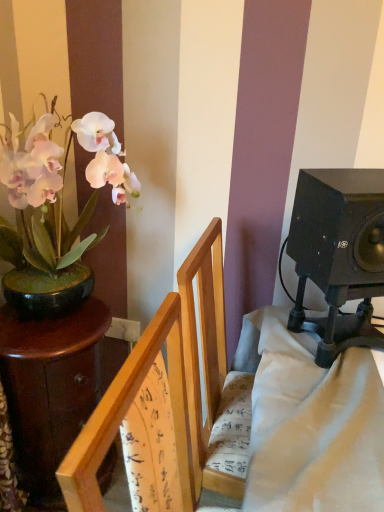
Question: Is black matte speaker at right not near dark brown wooden table at left?

Choices:
 (A) yes
 (B) no

Answer: (B)

Question: Would you say black matte speaker at right contains dark brown wooden table at left?

Choices:
 (A) no
 (B) yes

Answer: (A)

Question: Is black matte speaker at right to the left of dark brown wooden table at left from the viewer's perspective?

Choices:
 (A) yes
 (B) no

Answer: (B)

Question: Does black matte speaker at right have a lesser width compared to dark brown wooden table at left?

Choices:
 (A) no
 (B) yes

Answer: (B)

Question: Is black matte speaker at right further to camera compared to dark brown wooden table at left?

Choices:
 (A) no
 (B) yes

Answer: (A)

Question: Based on their sizes in the image, would you say white matte orchid at left is bigger or smaller than wooden chair at center?

Choices:
 (A) big
 (B) small

Answer: (B)

Question: Based on their positions, is white matte orchid at left located to the left or right of wooden chair at center?

Choices:
 (A) left
 (B) right

Answer: (A)

Question: Is point (21, 162) positioned closer to the camera than point (94, 418)?

Choices:
 (A) closer
 (B) farther

Answer: (B)

Question: From their relative heights in the image, would you say white matte orchid at left is taller or shorter than wooden chair at center?

Choices:
 (A) tall
 (B) short

Answer: (A)

Question: From a real-world perspective, is white matte orchid at left above or below dark brown wooden table at left?

Choices:
 (A) above
 (B) below

Answer: (A)

Question: Looking at their shapes, would you say white matte orchid at left is wider or thinner than dark brown wooden table at left?

Choices:
 (A) wide
 (B) thin

Answer: (A)

Question: Visually, is white matte orchid at left positioned to the left or to the right of dark brown wooden table at left?

Choices:
 (A) left
 (B) right

Answer: (B)

Question: Considering the positions of point (112, 189) and point (104, 389), is point (112, 189) closer or farther from the camera than point (104, 389)?

Choices:
 (A) farther
 (B) closer

Answer: (B)

Question: From a real-world perspective, is black matte speaker at right physically located above or below dark brown wooden table at left?

Choices:
 (A) above
 (B) below

Answer: (A)

Question: Does point (332, 188) appear closer or farther from the camera than point (9, 313)?

Choices:
 (A) closer
 (B) farther

Answer: (A)